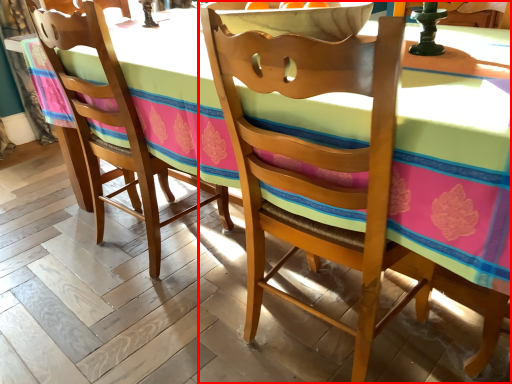
Question: From the image's perspective, where is chair (annotated by the red box) located in relation to chair in the image?

Choices:
 (A) below
 (B) above

Answer: (A)